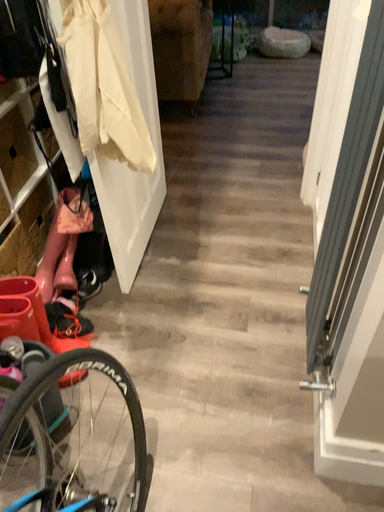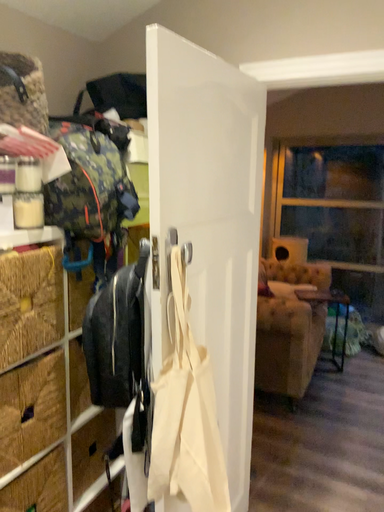
Question: How did the camera likely rotate when shooting the video?

Choices:
 (A) rotated left
 (B) rotated right

Answer: (A)